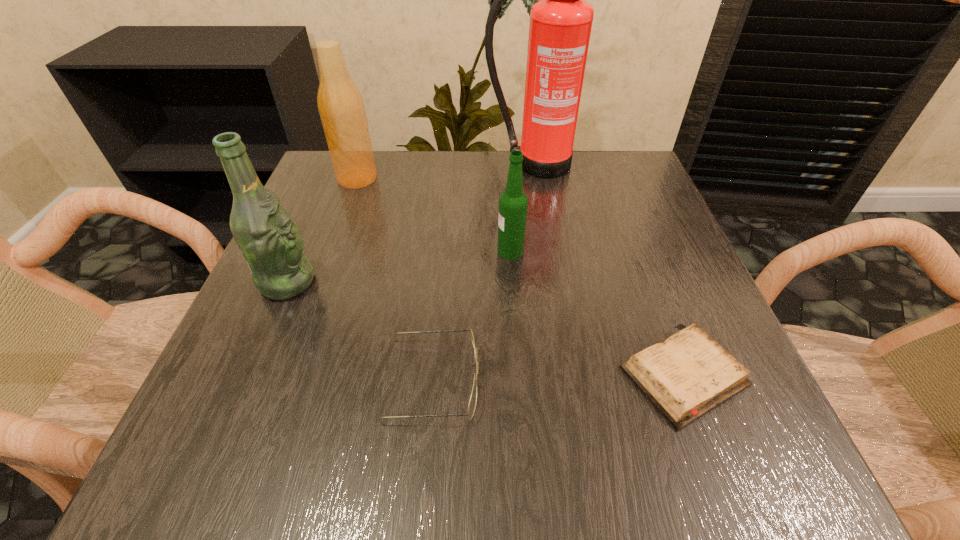
Locate an element on the screen. This screenshot has height=540, width=960. object that is the third closest to the shortest beer bottle is located at coordinates (560, 26).

Where is `object that stands as the second closest to the rightmost beer bottle`? Image resolution: width=960 pixels, height=540 pixels. object that stands as the second closest to the rightmost beer bottle is located at coordinates (688, 374).

Locate an element on the screen. This screenshot has width=960, height=540. the second closest beer bottle to the spectacles is located at coordinates (513, 203).

Identify the location of beer bottle that is the second closest to the spectacles. The height and width of the screenshot is (540, 960). (513, 203).

Identify the location of vacant region that satisfies the following two spatial constraints: 1. at the nozzle of the tallest object; 2. on the surface of the nearest beer bottle. (550, 282).

I want to click on free spot that satisfies the following two spatial constraints: 1. at the nozzle of the tallest object; 2. on the label of the third shortest object, so click(x=545, y=251).

Find the location of `free space that satisfies the following two spatial constraints: 1. on the surface of the nearest beer bottle; 2. on the left side of the diary`. free space that satisfies the following two spatial constraints: 1. on the surface of the nearest beer bottle; 2. on the left side of the diary is located at coordinates (247, 376).

Where is `vacant point that satisfies the following two spatial constraints: 1. at the nozzle of the diary; 2. on the left side of the tallest object`? vacant point that satisfies the following two spatial constraints: 1. at the nozzle of the diary; 2. on the left side of the tallest object is located at coordinates (565, 376).

The height and width of the screenshot is (540, 960). I want to click on blank space that satisfies the following two spatial constraints: 1. at the nozzle of the tallest object; 2. on the surface of the nearest beer bottle, so click(550, 282).